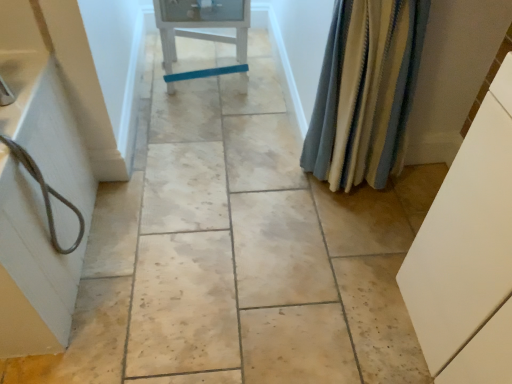
Locate an element on the screen. vacant space in front of white painted wood chair at center is located at coordinates (205, 130).